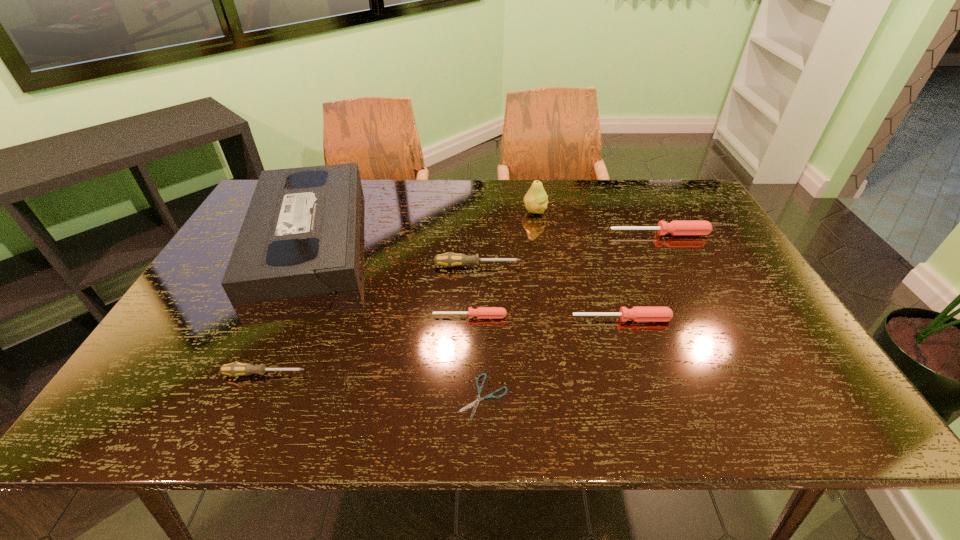
At what (x,y) coordinates should I click in order to perform the action: click on free space that satisfies the following two spatial constraints: 1. on the back side of the second biggest red screwdriver; 2. at the tip of the farther gray screwdriver. Please return your answer as a coordinate pair (x, y). Looking at the image, I should click on (604, 266).

Identify the location of free spot that satisfies the following two spatial constraints: 1. on the front side of the second tallest object; 2. on the left side of the second shortest object. (267, 316).